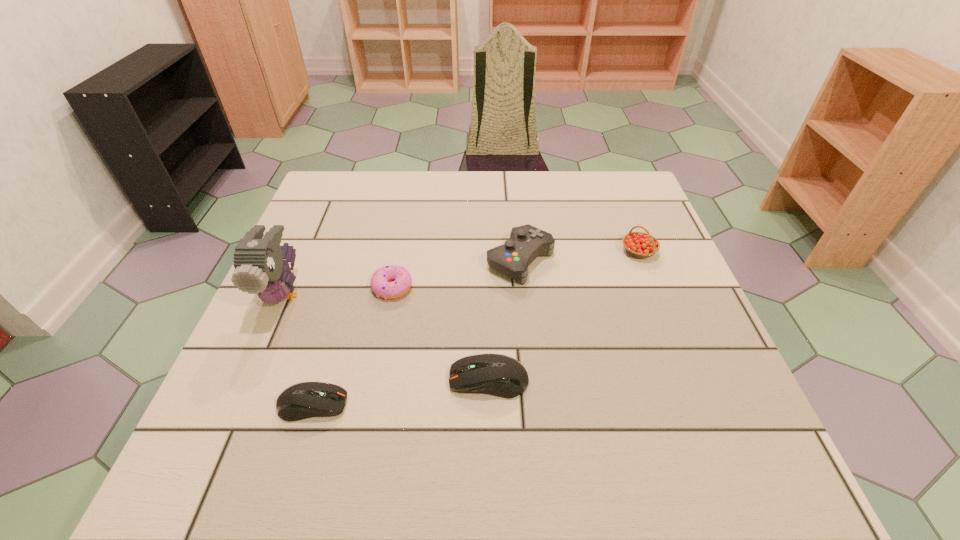
This screenshot has width=960, height=540. I want to click on free spot between the bird and the doughnut, so pos(338,291).

Locate an element on the screen. empty location between the doughnut and the bird is located at coordinates (338, 291).

The height and width of the screenshot is (540, 960). In order to click on free space that is in between the tallest object and the doughnut in this screenshot , I will do `click(338, 291)`.

Locate an element on the screen. Image resolution: width=960 pixels, height=540 pixels. free area in between the left computer equipment and the strawberry is located at coordinates (475, 328).

At what (x,y) coordinates should I click in order to perform the action: click on object that stands as the fifth closest to the doughnut. Please return your answer as a coordinate pair (x, y). The height and width of the screenshot is (540, 960). Looking at the image, I should click on point(638,244).

Where is `object that stands as the second closest to the left computer equipment`? object that stands as the second closest to the left computer equipment is located at coordinates 499,375.

Image resolution: width=960 pixels, height=540 pixels. I want to click on vacant space that satisfies the following two spatial constraints: 1. on the front side of the control; 2. on the button of the taller computer equipment, so click(533, 380).